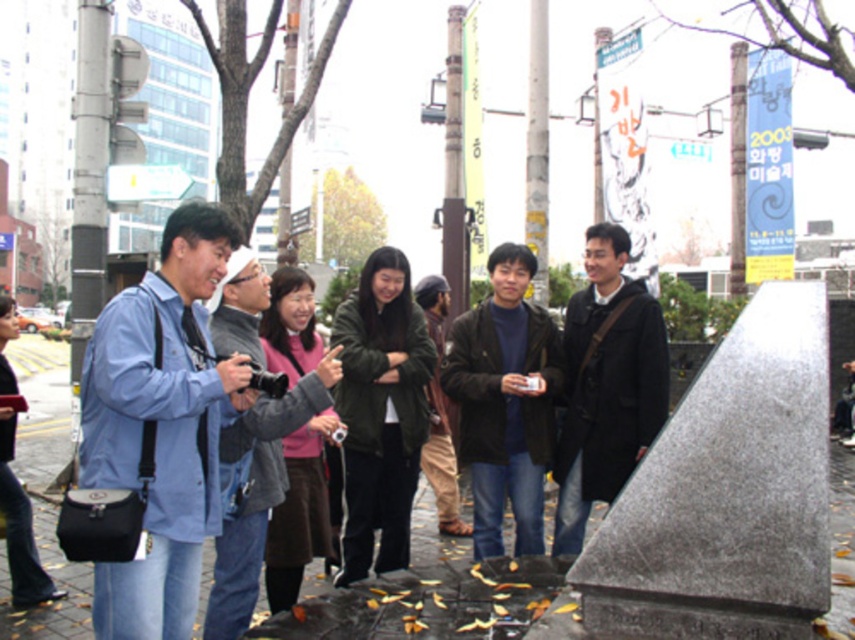
Is dark brown leather jacket at center above pink fleece jacket at center?

Indeed, dark brown leather jacket at center is positioned over pink fleece jacket at center.

Which is in front, point (540, 310) or point (282, 556)?

Point (282, 556) is in front.

Image resolution: width=855 pixels, height=640 pixels. I want to click on dark brown leather jacket at center, so click(504, 401).

Which is in front, point (186, 284) or point (310, 451)?

Point (186, 284) is in front.

In the scene shown: Which of these two, denim jacket at left or pink fleece jacket at center, stands taller?

Standing taller between the two is denim jacket at left.

Is point (81, 387) positioned after point (276, 608)?

No, it is not.

The image size is (855, 640). Find the location of `denim jacket at left`. denim jacket at left is located at coordinates (161, 424).

Is black wool coat at center positioned at the back of khaki cotton pants at center?

No, black wool coat at center is closer to the viewer.

Image resolution: width=855 pixels, height=640 pixels. I want to click on black wool coat at center, so click(606, 385).

Locate an element on the screen. The image size is (855, 640). black wool coat at center is located at coordinates (606, 385).